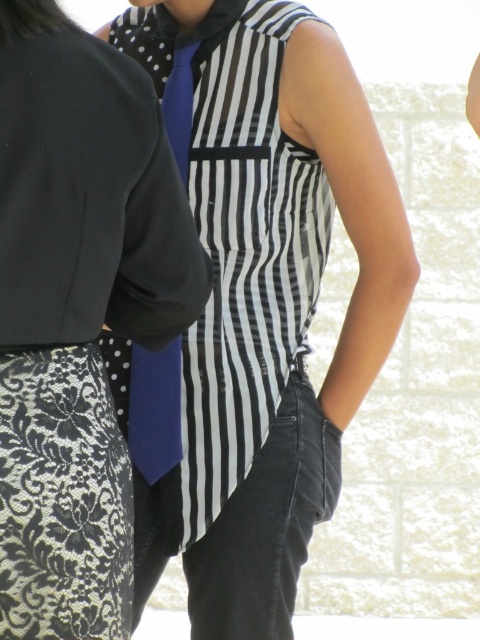
Question: Can you confirm if black lace skirt at lower left is positioned below blue satin tie at center?

Choices:
 (A) no
 (B) yes

Answer: (A)

Question: In this image, where is matte striped shirt at center located relative to blue satin tie at center?

Choices:
 (A) below
 (B) above

Answer: (B)

Question: Which point is closer to the camera?

Choices:
 (A) black lace skirt at lower left
 (B) matte striped shirt at center

Answer: (A)

Question: Based on their relative distances, which object is nearer to the matte striped shirt at center?

Choices:
 (A) black lace skirt at lower left
 (B) blue satin tie at center

Answer: (B)

Question: Does matte striped shirt at center have a lesser width compared to black lace skirt at lower left?

Choices:
 (A) yes
 (B) no

Answer: (B)

Question: Which object is positioned closest to the matte striped shirt at center?

Choices:
 (A) black lace skirt at lower left
 (B) blue satin tie at center

Answer: (B)